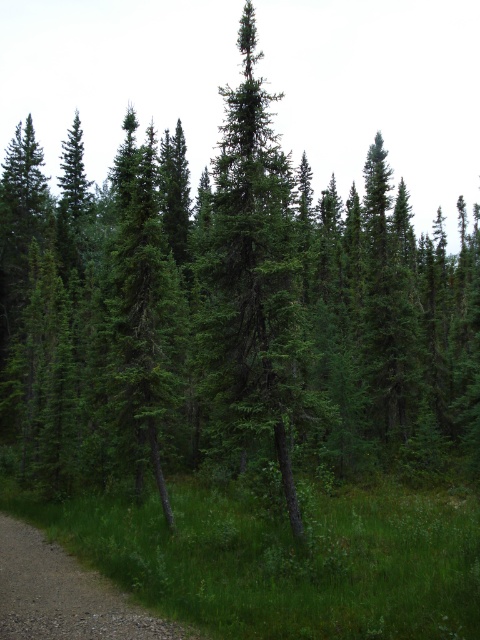
Who is more forward, (283, 358) or (16, 621)?

Point (16, 621) is more forward.

What are the coordinates of `green needle-like at center` in the screenshot? It's located at (252, 273).

The image size is (480, 640). What are the coordinates of `green needle-like at center` in the screenshot? It's located at (252, 273).